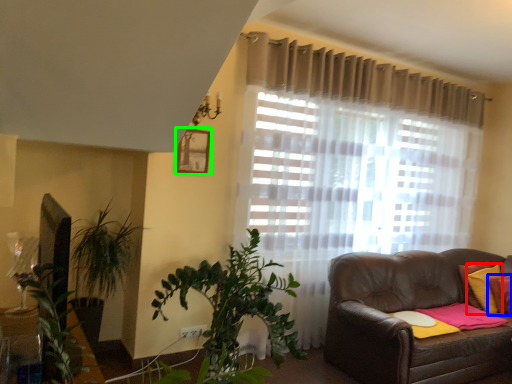
Question: Which is nearer to the pillow (highlighted by a red box)? pillow (highlighted by a blue box) or picture frame (highlighted by a green box).

Choices:
 (A) pillow
 (B) picture frame

Answer: (A)